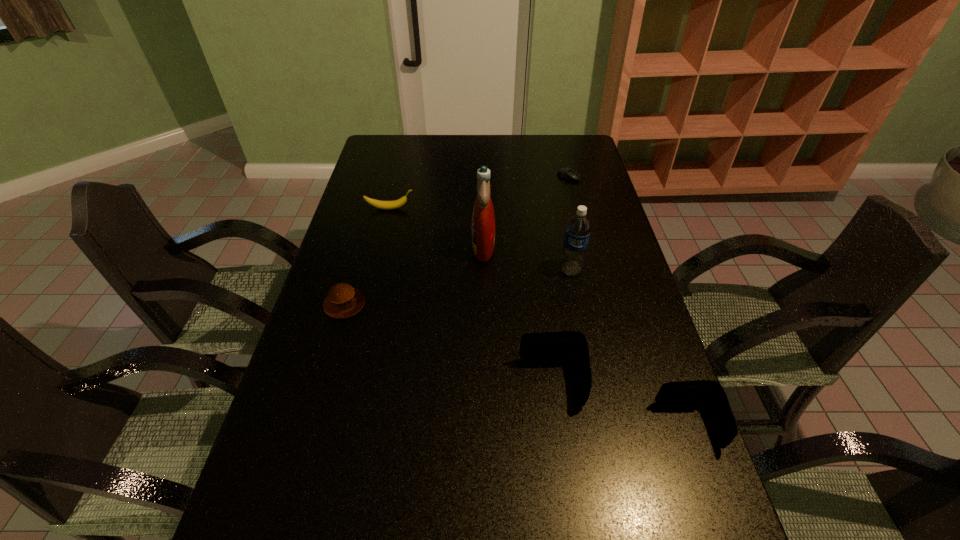
Please point a spot on the left to add another wallet. Please provide its 2D coordinates. Your answer should be formatted as a tuple, i.e. [(x, y)], where the tuple contains the x and y coordinates of a point satisfying the conditions above.

[(435, 345)]